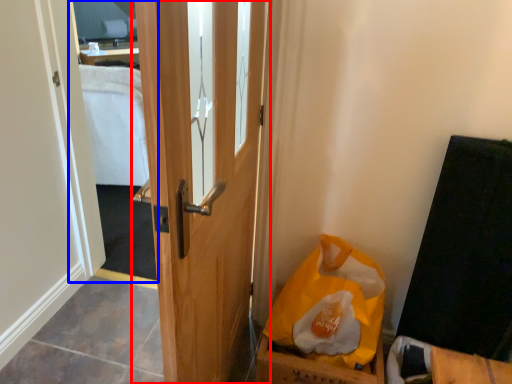
Question: Among these objects, which one is farthest to the camera, door (highlighted by a red box) or mirror (highlighted by a blue box)?

Choices:
 (A) door
 (B) mirror

Answer: (B)